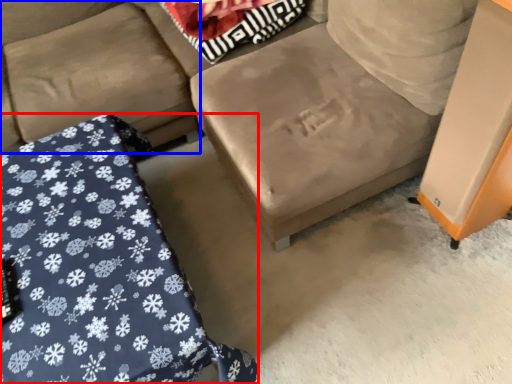
Question: Among these objects, which one is farthest to the camera, furniture (highlighted by a red box) or couch (highlighted by a blue box)?

Choices:
 (A) furniture
 (B) couch

Answer: (B)